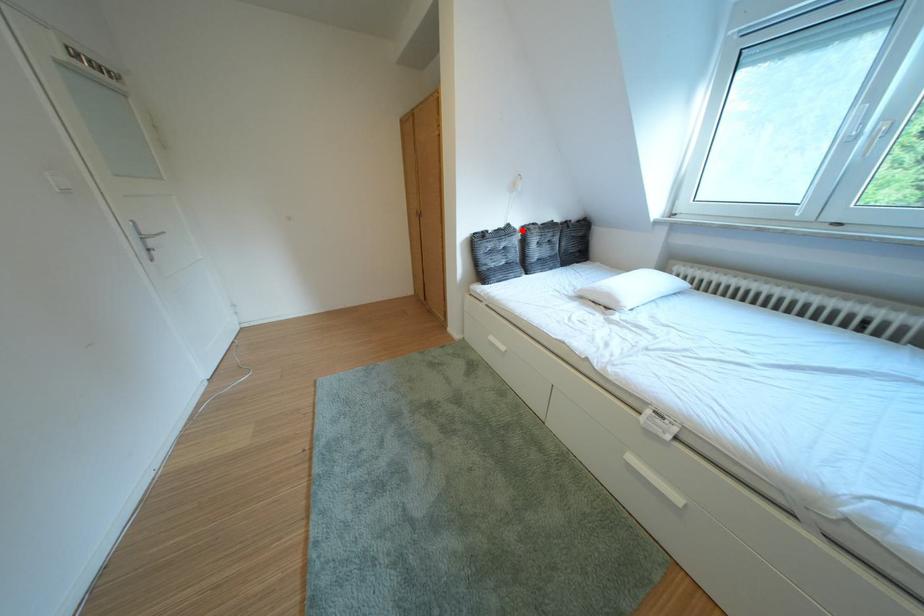
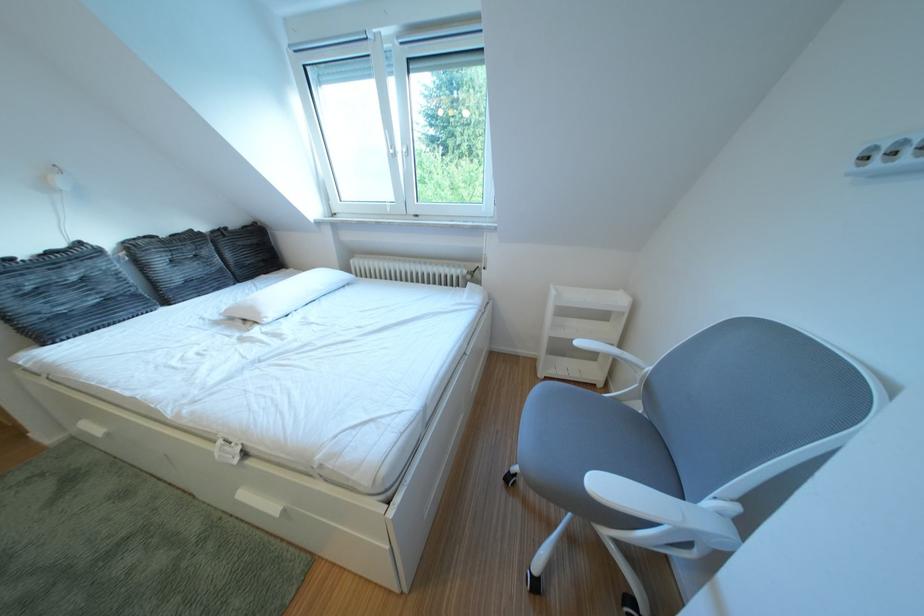
In the second image, find the point that corresponds to the highlighted location in the first image.

(93, 249)